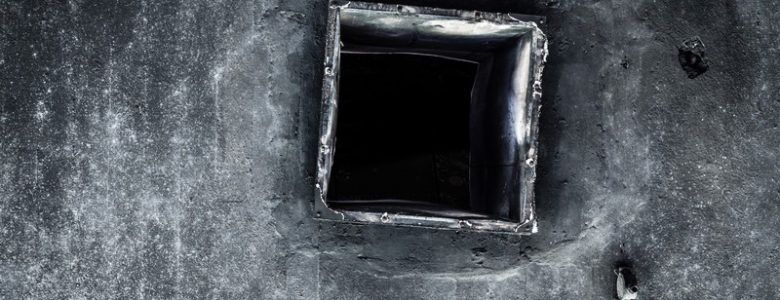
The height and width of the screenshot is (300, 780). In order to click on interior of passageway in this screenshot , I will do `click(448, 182)`.